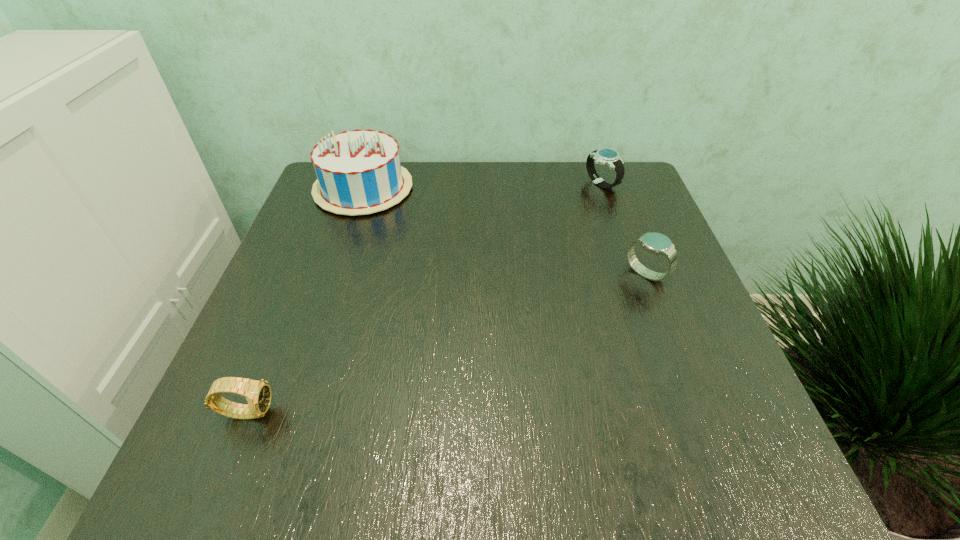
Where is `watch that is at the far edge`? This screenshot has width=960, height=540. watch that is at the far edge is located at coordinates (606, 156).

You are a GUI agent. You are given a task and a screenshot of the screen. Output one action in this format:
    pyautogui.click(x=<x>, y=<y>)
    Task: Click on the birthday cake that is at the left edge
    
    Given the screenshot: What is the action you would take?
    pos(359,172)

Locate an element on the screen. Image resolution: width=960 pixels, height=540 pixels. watch present at the left edge is located at coordinates (258, 394).

This screenshot has height=540, width=960. In order to click on object at the far left corner in this screenshot , I will do `click(359, 172)`.

Find the location of a particular element. The height and width of the screenshot is (540, 960). object that is at the far right corner is located at coordinates (606, 156).

Locate an element on the screen. The image size is (960, 540). free space at the far edge of the desktop is located at coordinates (421, 209).

Identify the location of free region at the near edge of the desktop. The width and height of the screenshot is (960, 540). (465, 437).

The height and width of the screenshot is (540, 960). I want to click on vacant region at the left edge, so pos(348,266).

In the image, there is a desktop. Where is `free space at the right edge`? This screenshot has height=540, width=960. free space at the right edge is located at coordinates (648, 256).

In the image, there is a desktop. In order to click on free space at the far right corner in this screenshot , I will do `click(627, 167)`.